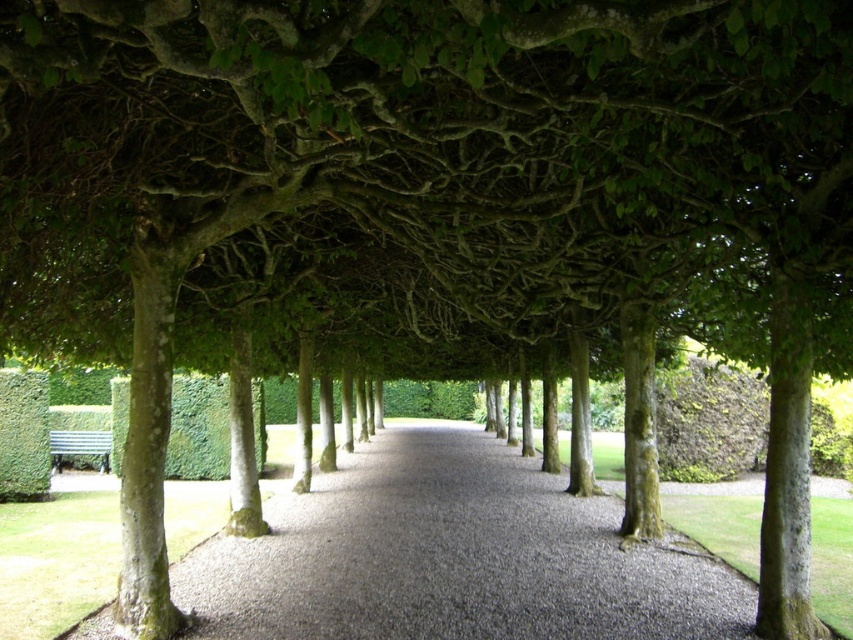
Between smooth gravel path at center and metallic silver bench at lower left, which one is positioned lower?

smooth gravel path at center is below.

What do you see at coordinates (451, 556) in the screenshot?
I see `smooth gravel path at center` at bounding box center [451, 556].

Locate an element on the screen. smooth gravel path at center is located at coordinates (451, 556).